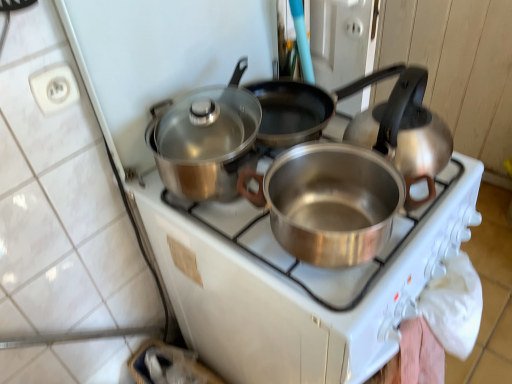
Question: Are shiny metallic pot at center and satin silver kettle at right beside each other?

Choices:
 (A) no
 (B) yes

Answer: (A)

Question: Could you tell me if shiny metallic pot at center is facing satin silver kettle at right?

Choices:
 (A) yes
 (B) no

Answer: (A)

Question: Is shiny metallic pot at center located outside satin silver kettle at right?

Choices:
 (A) yes
 (B) no

Answer: (A)

Question: Considering the relative positions of shiny metallic pot at center and satin silver kettle at right in the image provided, is shiny metallic pot at center in front of satin silver kettle at right?

Choices:
 (A) no
 (B) yes

Answer: (A)

Question: Is shiny metallic pot at center taller than satin silver kettle at right?

Choices:
 (A) yes
 (B) no

Answer: (B)

Question: From a real-world perspective, is shiny metallic pot at center under satin silver kettle at right?

Choices:
 (A) yes
 (B) no

Answer: (B)

Question: Does shiny metallic pot at center have a lesser width compared to matte white stove at center?

Choices:
 (A) no
 (B) yes

Answer: (A)

Question: Considering the relative sizes of shiny metallic pot at center and matte white stove at center in the image provided, is shiny metallic pot at center taller than matte white stove at center?

Choices:
 (A) no
 (B) yes

Answer: (A)

Question: From the image's perspective, is shiny metallic pot at center located beneath matte white stove at center?

Choices:
 (A) yes
 (B) no

Answer: (B)

Question: Considering the relative sizes of shiny metallic pot at center and matte white stove at center in the image provided, is shiny metallic pot at center bigger than matte white stove at center?

Choices:
 (A) yes
 (B) no

Answer: (B)

Question: Is shiny metallic pot at center at the right side of matte white stove at center?

Choices:
 (A) no
 (B) yes

Answer: (B)

Question: From the image's perspective, is shiny metallic pot at center on top of matte white stove at center?

Choices:
 (A) no
 (B) yes

Answer: (B)

Question: From the image's perspective, is matte white stove at center on satin silver kettle at right?

Choices:
 (A) no
 (B) yes

Answer: (A)